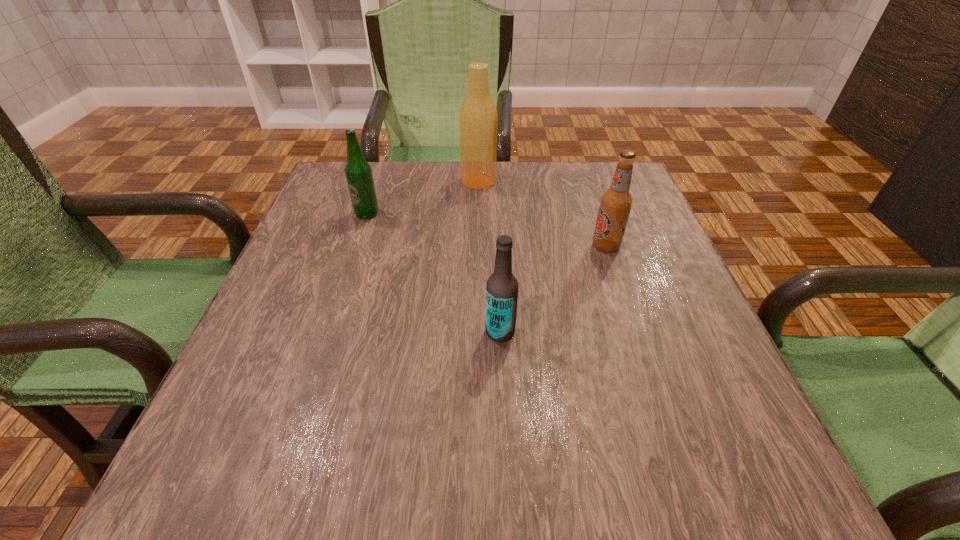
The height and width of the screenshot is (540, 960). Find the location of `vacant area located on the front label of the second nearest beer bottle`. vacant area located on the front label of the second nearest beer bottle is located at coordinates tap(560, 246).

Where is `free region located on the side of the nearest object with the label`? This screenshot has width=960, height=540. free region located on the side of the nearest object with the label is located at coordinates (299, 332).

I want to click on blank space located on the side of the nearest object with the label, so click(315, 332).

You are a GUI agent. You are given a task and a screenshot of the screen. Output one action in this format:
    pyautogui.click(x=<x>, y=<y>)
    Task: Click on the vacant space situated on the side of the nearest object with the label
    This screenshot has height=540, width=960.
    Given the screenshot: What is the action you would take?
    pyautogui.click(x=281, y=332)

Locate an element on the screen. This screenshot has width=960, height=540. free space located 0.130m on the label of the third nearest beer bottle is located at coordinates (353, 256).

At what (x,y) coordinates should I click in order to perform the action: click on object that is at the left edge. Please return your answer as a coordinate pair (x, y). The width and height of the screenshot is (960, 540). Looking at the image, I should click on (358, 171).

Identify the location of object situated at the right edge. The width and height of the screenshot is (960, 540). (616, 202).

Identify the location of object that is at the far left corner. (358, 171).

Where is `vacant area at the far edge of the desktop`? Image resolution: width=960 pixels, height=540 pixels. vacant area at the far edge of the desktop is located at coordinates (537, 192).

This screenshot has width=960, height=540. Identify the location of vacant region at the near edge of the desktop. (450, 469).